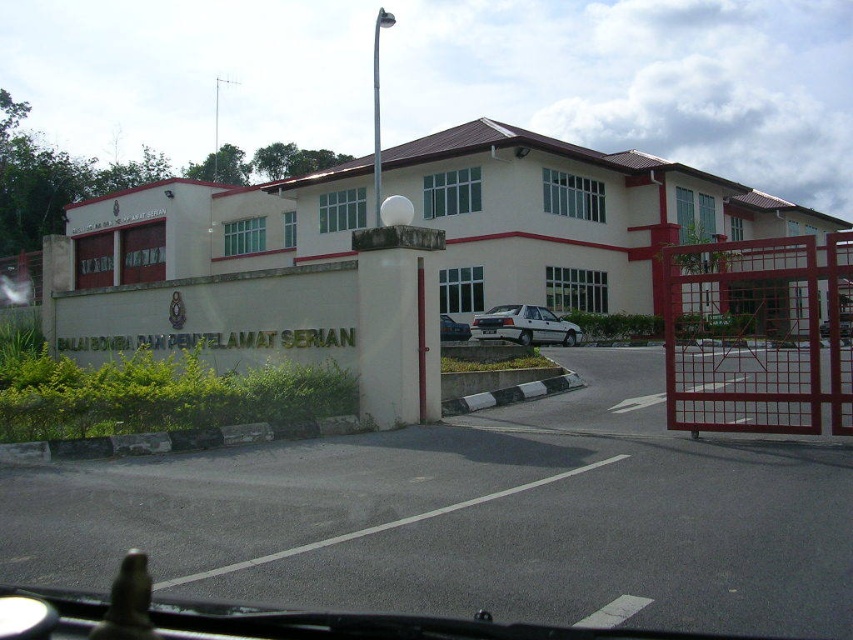
You are driving a delivery van that is 6 meters long and need to park it between the asphalt pavement at center and the white matte sedan at center. Is there enough space to park the van without overlapping either of them?

The distance between the asphalt pavement at center and the white matte sedan at center is 17.66 meters. Since the van is 6 meters long, there is sufficient space to park it between them without overlapping either.